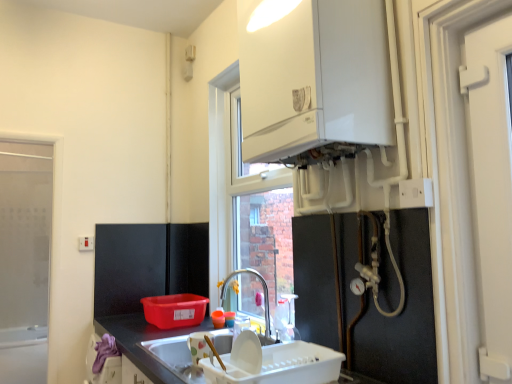
Question: Does white glossy boiler at upper center appear on the left side of white matte door at right?

Choices:
 (A) no
 (B) yes

Answer: (B)

Question: Is white glossy boiler at upper center next to white matte door at right and touching it?

Choices:
 (A) yes
 (B) no

Answer: (B)

Question: From the image's perspective, would you say white glossy boiler at upper center is positioned over white matte door at right?

Choices:
 (A) yes
 (B) no

Answer: (A)

Question: Is white glossy boiler at upper center bigger than white matte door at right?

Choices:
 (A) no
 (B) yes

Answer: (B)

Question: Considering the relative sizes of white glossy boiler at upper center and white matte door at right in the image provided, is white glossy boiler at upper center shorter than white matte door at right?

Choices:
 (A) yes
 (B) no

Answer: (A)

Question: Is white plastic electric outlet at upper left, which is the second electric outlet from front to back, bigger or smaller than metallic silver pipes at lower right, acting as the 2th appliance starting from the bottom?

Choices:
 (A) big
 (B) small

Answer: (B)

Question: Is point (84, 243) closer or farther from the camera than point (366, 306)?

Choices:
 (A) farther
 (B) closer

Answer: (A)

Question: Is white plastic electric outlet at upper left, which is the second electric outlet from front to back, situated inside metallic silver pipes at lower right, acting as the 2th appliance starting from the bottom, or outside?

Choices:
 (A) outside
 (B) inside

Answer: (A)

Question: From the image's perspective, is white plastic electric outlet at upper left, marked as the 2th electric outlet in a right-to-left arrangement, positioned above or below metallic silver pipes at lower right, acting as the 2th appliance starting from the bottom?

Choices:
 (A) above
 (B) below

Answer: (A)

Question: From a real-world perspective, relative to white plastic dish rack at lower center, acting as the 2th appliance starting from the top, is metallic silver pipes at lower right, the 1th appliance when ordered from top to bottom, vertically above or below?

Choices:
 (A) above
 (B) below

Answer: (A)

Question: Relative to white plastic dish rack at lower center, acting as the 2th appliance starting from the top, is metallic silver pipes at lower right, acting as the 2th appliance starting from the bottom, in front or behind?

Choices:
 (A) front
 (B) behind

Answer: (B)

Question: Visually, is metallic silver pipes at lower right, the 1th appliance when ordered from top to bottom, positioned to the left or to the right of white plastic dish rack at lower center, acting as the 2th appliance starting from the top?

Choices:
 (A) left
 (B) right

Answer: (B)

Question: In terms of width, does metallic silver pipes at lower right, acting as the 2th appliance starting from the bottom, look wider or thinner when compared to white plastic dish rack at lower center, acting as the 2th appliance starting from the top?

Choices:
 (A) thin
 (B) wide

Answer: (A)

Question: From a real-world perspective, is white glossy boiler at upper center physically located above or below white plastic electric outlet at upper left, the first electric outlet from the left?

Choices:
 (A) below
 (B) above

Answer: (B)

Question: In the image, is white glossy boiler at upper center positioned in front of or behind white plastic electric outlet at upper left, the second electric outlet positioned from the top?

Choices:
 (A) behind
 (B) front

Answer: (B)